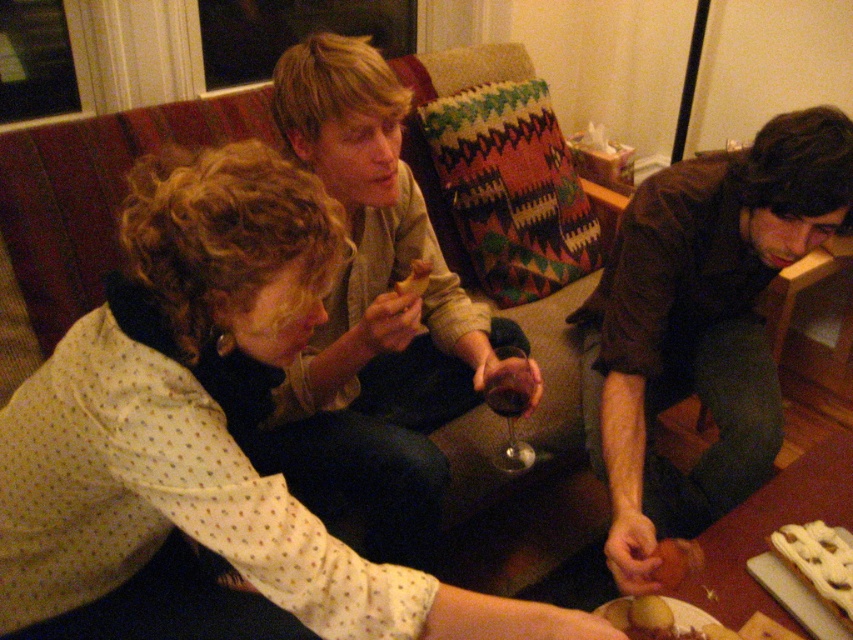
You are a guest at the gathering and want to grab the closest item between the white glazed pastry at lower right and the yellow matte potato at lower center. Which one should you reach for?

The white glazed pastry at lower right is closer to you, so you should reach for it first.

You are a guest at this gathering and want to grab a snack. The white glazed pastry at lower right and the smooth brown bread at lower center are on the coffee table. Can you reach both snacks without moving your chair? The distance between them is 6.81 inches.

The white glazed pastry at lower right and the smooth brown bread at lower center are 6.81 inches apart, so you can easily reach both snacks without moving your chair since the distance is manageable.

You are a chef preparing a dish and need to place the yellow matte potato at lower center and the smooth brown bread at lower center on a small plate that is 2 inches in diameter. Can both items fit on the plate without overlapping?

The yellow matte potato at lower center and smooth brown bread at lower center are 2.09 inches apart from each other. Since the plate is only 2 inches in diameter, the items cannot fit without overlapping as their combined space exceeds the plate size.